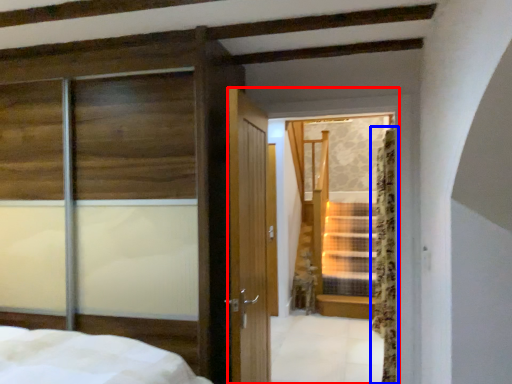
Question: Which point is further to the camera, glass door (highlighted by a red box) or curtain (highlighted by a blue box)?

Choices:
 (A) glass door
 (B) curtain

Answer: (B)